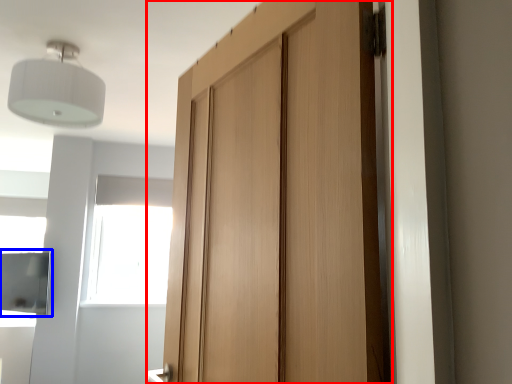
Question: Which point is further to the camera, door (highlighted by a red box) or cabinetry (highlighted by a blue box)?

Choices:
 (A) door
 (B) cabinetry

Answer: (B)